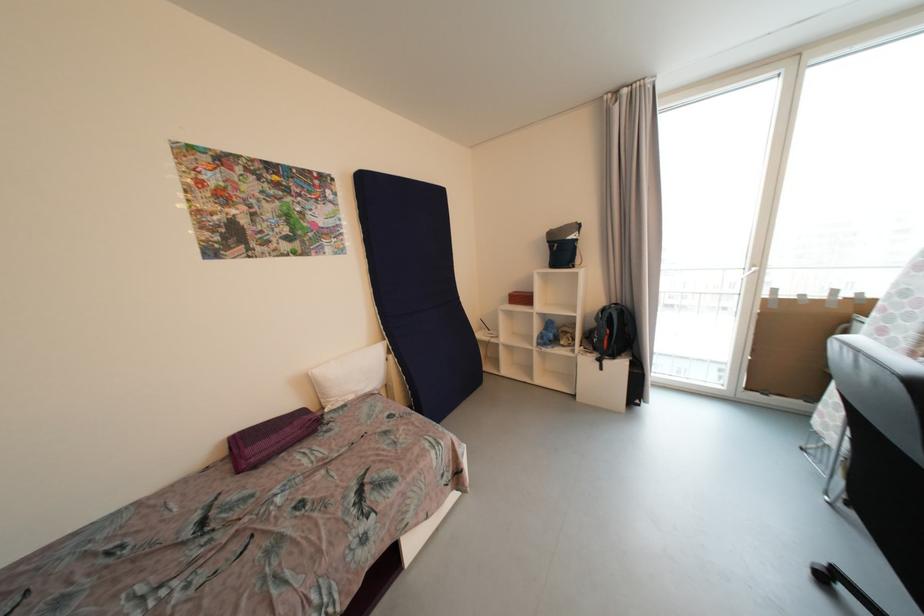
Where would you mov the blue folded mattress? Please return your answer as a coordinate pair (x, y).

(418, 289)